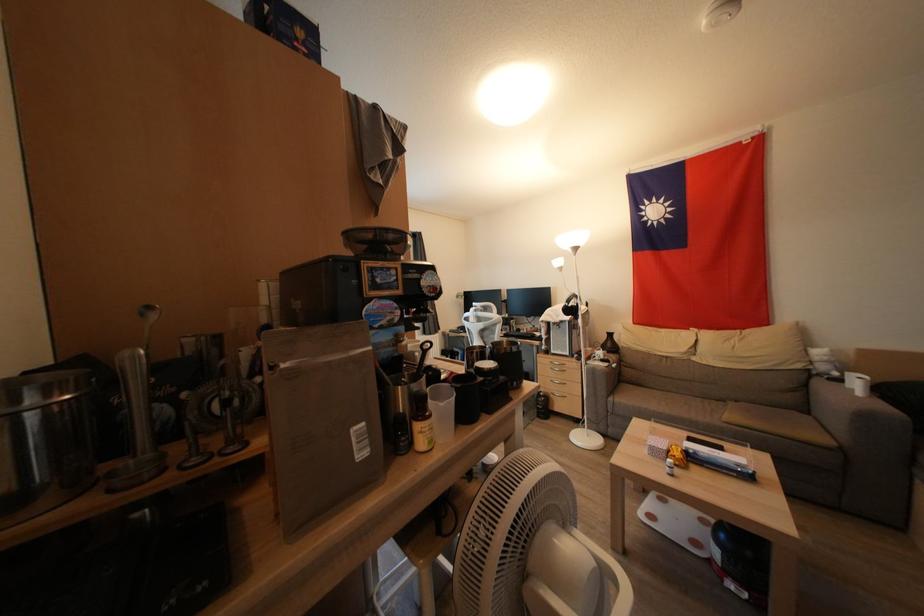
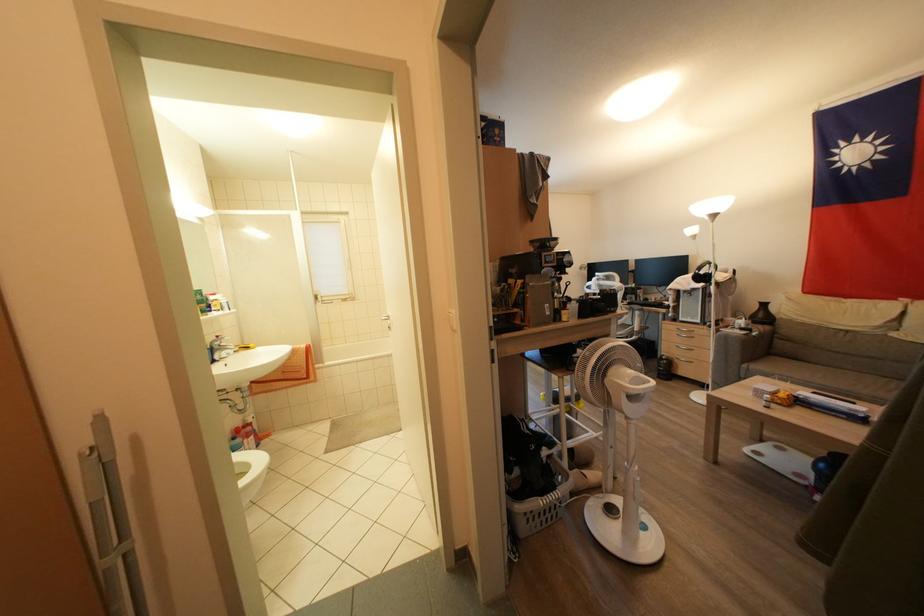
Locate, in the second image, the point that corresponds to [614,403] in the first image.

(748, 370)